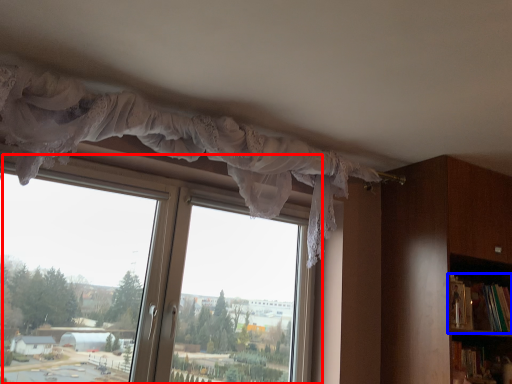
Question: Which of the following is the farthest to the observer, window (highlighted by a red box) or book (highlighted by a blue box)?

Choices:
 (A) window
 (B) book

Answer: (B)